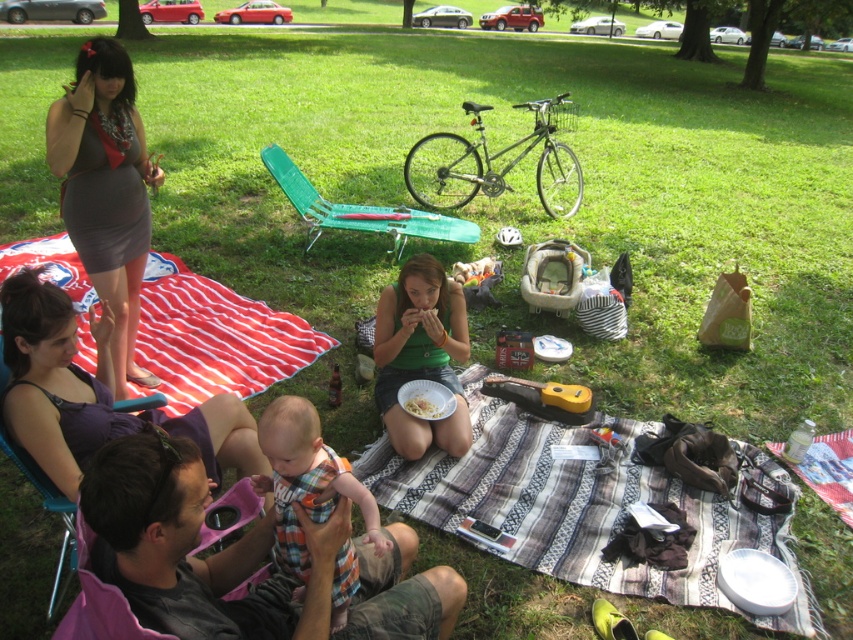
Can you confirm if plaid fabric picnic blanket at center is bigger than purple fabric dress at upper left?

Yes.

Which is more to the left, plaid fabric picnic blanket at center or purple fabric dress at upper left?

purple fabric dress at upper left is more to the left.

Who is more forward, [616,563] or [38,352]?

Point [38,352] is more forward.

Find the location of a particular element. The image size is (853, 640). plaid fabric picnic blanket at center is located at coordinates (577, 506).

Can you confirm if green grass at center is positioned below plaid fabric baby at center?

No.

Which is behind, point (642, 214) or point (283, 557)?

The point (642, 214) is more distant.

Find the location of a particular element. Image resolution: width=853 pixels, height=640 pixels. green grass at center is located at coordinates (531, 202).

Identify the location of green grass at center. (531, 202).

Looking at this image, does plaid fabric picnic blanket at center appear over white matte paper plate at center?

No.

Can you confirm if plaid fabric picnic blanket at center is positioned below white matte paper plate at center?

Correct, plaid fabric picnic blanket at center is located below white matte paper plate at center.

Is point (624, 589) positioned after point (422, 412)?

No, it is in front of (422, 412).

Image resolution: width=853 pixels, height=640 pixels. What are the coordinates of `plaid fabric picnic blanket at center` in the screenshot? It's located at [x=577, y=506].